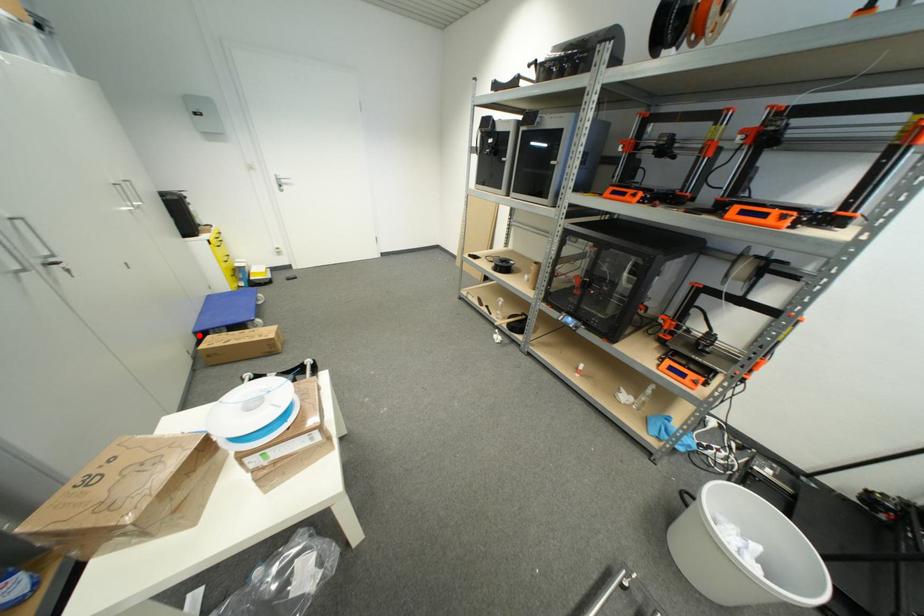
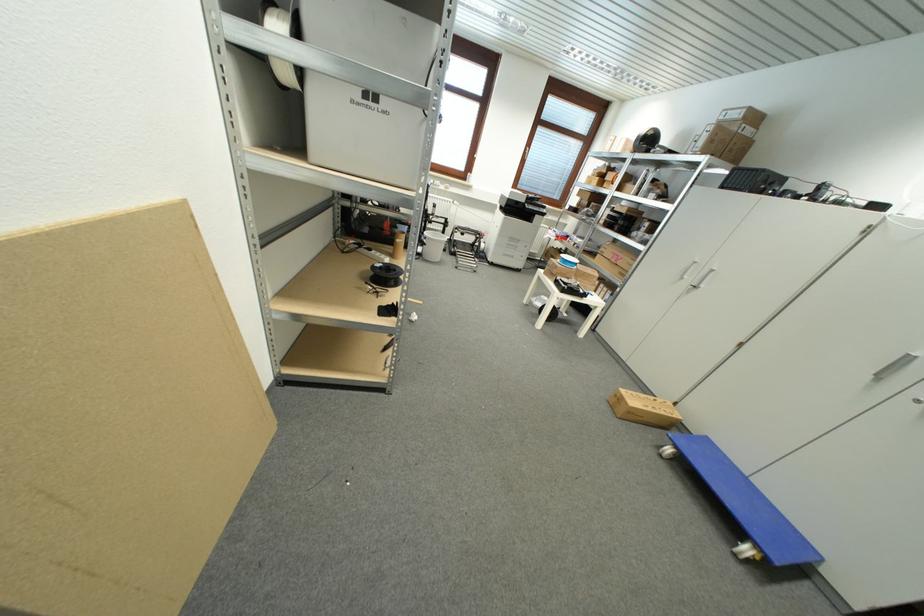
Question: I am providing you with two images of the same scene from different viewpoints. Image1 has a red point marked. In image2, the corresponding 3D location appears at what relative position? Reply with the corresponding letter.

Choices:
 (A) Closer
 (B) Farther

Answer: (B)